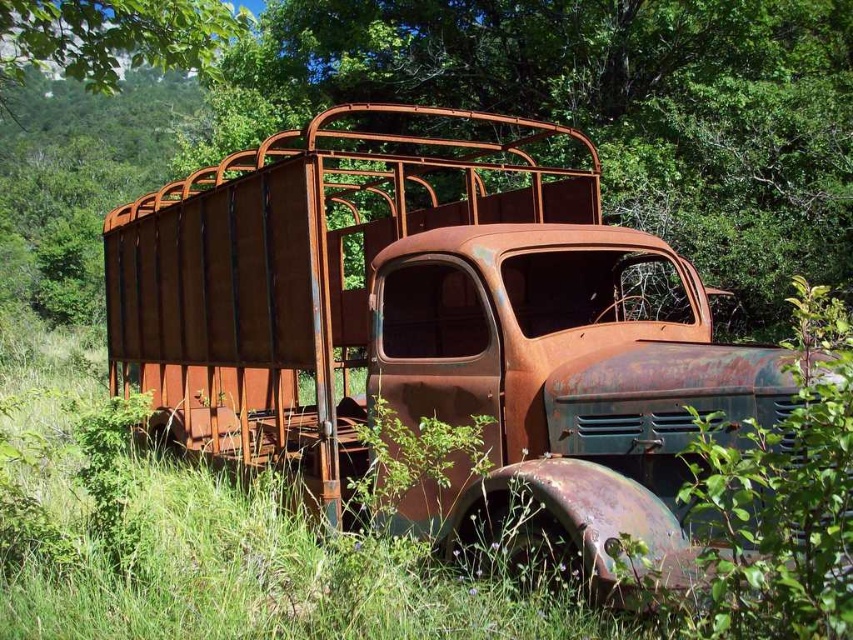
Which is above, rusty metal trailer truck at center or rusty metal truck at center?

rusty metal truck at center is higher up.

Locate an element on the screen. rusty metal trailer truck at center is located at coordinates (448, 349).